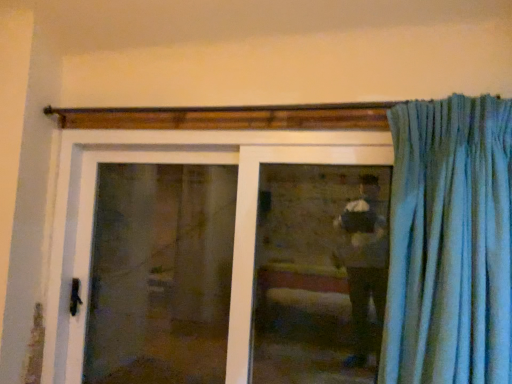
I want to click on clear glass window at center, so click(x=317, y=275).

Could you tell me if clear glass window at center is turned towards transparent glass screen door at center?

No, clear glass window at center is not turned towards transparent glass screen door at center.

Is the surface of clear glass window at center in direct contact with transparent glass screen door at center?

No.

Is clear glass window at center wider than transparent glass screen door at center?

No, clear glass window at center is not wider than transparent glass screen door at center.

What's the angular difference between clear glass window at center and white plastic door at center's facing directions?

The facing directions of clear glass window at center and white plastic door at center are 0.00512 degrees apart.

Is clear glass window at center wider or thinner than white plastic door at center?

Clearly, clear glass window at center has less width compared to white plastic door at center.

From the image's perspective, is clear glass window at center positioned above or below white plastic door at center?

clear glass window at center is above white plastic door at center.

From the picture: In terms of height, does transparent glass screen door at center look taller or shorter compared to clear glass window at center?

In the image, transparent glass screen door at center appears to be taller than clear glass window at center.

Which is closer to the camera, (194, 167) or (309, 370)?

Point (194, 167).

Is transparent glass screen door at center not near clear glass window at center?

No, transparent glass screen door at center is not far from clear glass window at center.

Locate an element on the screen. The image size is (512, 384). screen door lying behind the clear glass window at center is located at coordinates (160, 274).

In the scene shown: Which object is closer to the camera taking this photo, transparent glass screen door at center or white plastic door at center?

Positioned in front is white plastic door at center.

Between transparent glass screen door at center and white plastic door at center, which one has smaller width?

With smaller width is transparent glass screen door at center.

Is transparent glass screen door at center facing towards white plastic door at center?

Yes.

Can you confirm if white plastic door at center is shorter than transparent glass screen door at center?

Correct, white plastic door at center is not as tall as transparent glass screen door at center.

Is white plastic door at center beside transparent glass screen door at center?

No.

What's the angular difference between white plastic door at center and transparent glass screen door at center's facing directions?

white plastic door at center and transparent glass screen door at center are facing 0.00568 degrees away from each other.

Is white plastic door at center oriented towards transparent glass screen door at center?

Yes.

Is white plastic door at center surrounding clear glass window at center?

Yes, clear glass window at center is surrounded by white plastic door at center.

Is white plastic door at center wider or thinner than clear glass window at center?

white plastic door at center is wider than clear glass window at center.

Measure the distance from white plastic door at center to clear glass window at center.

15.29 inches.

Locate an element on the screen. This screenshot has height=384, width=512. window lying in front of the transparent glass screen door at center is located at coordinates (317, 275).

This screenshot has height=384, width=512. Identify the location of window lying behind the white plastic door at center. (317, 275).

Looking at the image, which one is located closer to clear glass window at center, white plastic door at center or transparent glass screen door at center?

The object closer to clear glass window at center is white plastic door at center.

Based on their spatial positions, is white plastic door at center or clear glass window at center further from transparent glass screen door at center?

Among the two, clear glass window at center is located further to transparent glass screen door at center.

Looking at the image, which one is located closer to white plastic door at center, transparent glass screen door at center or clear glass window at center?

The object closer to white plastic door at center is transparent glass screen door at center.

Estimate the real-world distances between objects in this image. Which object is further from clear glass window at center, transparent glass screen door at center or white plastic door at center?

transparent glass screen door at center is positioned further to the anchor clear glass window at center.

Looking at the image, which one is located closer to transparent glass screen door at center, clear glass window at center or white plastic door at center?

white plastic door at center lies closer to transparent glass screen door at center than the other object.

Looking at the image, which one is located closer to white plastic door at center, clear glass window at center or transparent glass screen door at center?

Among the two, transparent glass screen door at center is located nearer to white plastic door at center.

What are the coordinates of `door situated between transparent glass screen door at center and clear glass window at center from left to right` in the screenshot? It's located at (178, 163).